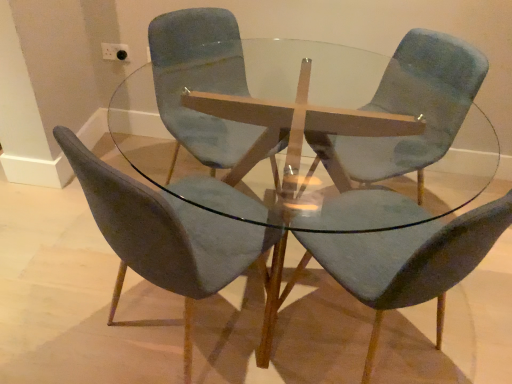
Where is `vacant position to the left of velvet blue chair at center, the first chair positioned from the left`? This screenshot has height=384, width=512. vacant position to the left of velvet blue chair at center, the first chair positioned from the left is located at coordinates (66, 303).